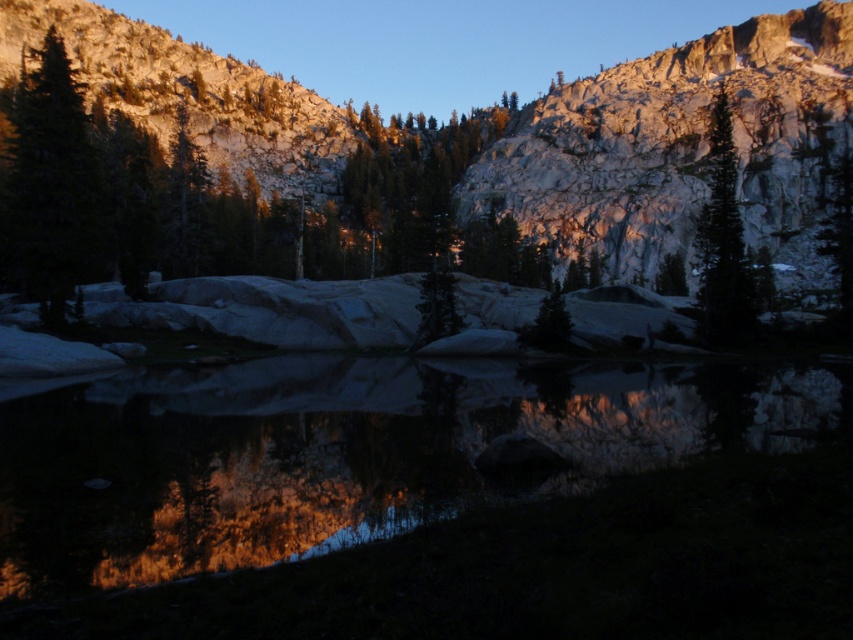
Can you confirm if transparent water at center is taller than green matte tree at left?

In fact, transparent water at center may be shorter than green matte tree at left.

Is point (259, 392) positioned before point (51, 44)?

Yes, point (259, 392) is closer to viewer.

Where is `transparent water at center`? The image size is (853, 640). transparent water at center is located at coordinates pos(346,452).

Is transparent water at center positioned behind green matte tree at upper right?

No, transparent water at center is in front of green matte tree at upper right.

Which is behind, point (36, 508) or point (735, 330)?

The point (735, 330) is more distant.

I want to click on transparent water at center, so click(x=346, y=452).

Which is above, green matte tree at left or green matte tree at upper right?

green matte tree at left

Between green matte tree at left and green matte tree at upper right, which one has less height?

With less height is green matte tree at upper right.

Describe the element at coordinates (51, 188) in the screenshot. I see `green matte tree at left` at that location.

In order to click on green matte tree at left in this screenshot , I will do `click(51, 188)`.